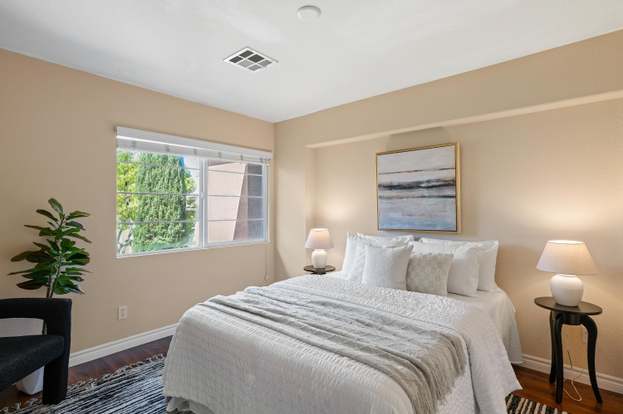
This screenshot has width=623, height=414. I want to click on cords that hold venetian blinds together in their folded up state, so [x=134, y=144], [x=167, y=149], [x=195, y=153], [x=217, y=153], [x=242, y=158], [x=260, y=160].